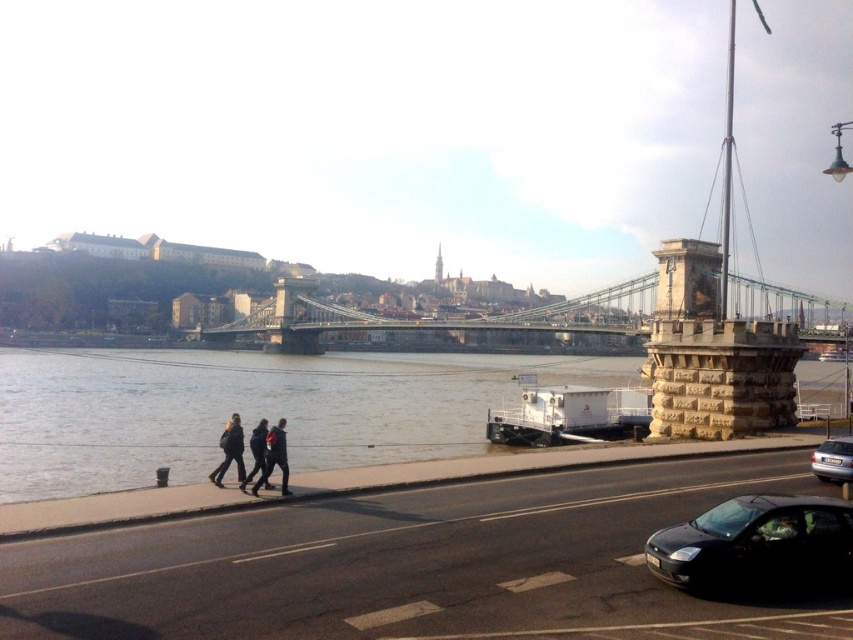
Question: Can you confirm if black glossy car at lower right is thinner than dark gray fabric coat at lower left?

Choices:
 (A) yes
 (B) no

Answer: (B)

Question: Which point is farther from the camera taking this photo?

Choices:
 (A) (270, 438)
 (B) (511, 435)
 (C) (819, 474)
 (D) (665, 566)

Answer: (B)

Question: Which object appears farthest from the camera in this image?

Choices:
 (A) dark gray fabric jacket at lower left
 (B) green metallic suspension bridge at center
 (C) brown water at lower center
 (D) dark blue jeans at lower center

Answer: (B)

Question: Is white matte ferry at lower right to the right of dark gray fabric coat at lower left from the viewer's perspective?

Choices:
 (A) no
 (B) yes

Answer: (B)

Question: Which object is closer to the camera taking this photo?

Choices:
 (A) dark blue jeans at lower center
 (B) black glossy car at lower right
 (C) dark gray fabric pants at lower center
 (D) green metallic suspension bridge at center

Answer: (B)

Question: Does brown water at lower center appear on the right side of black glossy car at lower right?

Choices:
 (A) no
 (B) yes

Answer: (A)